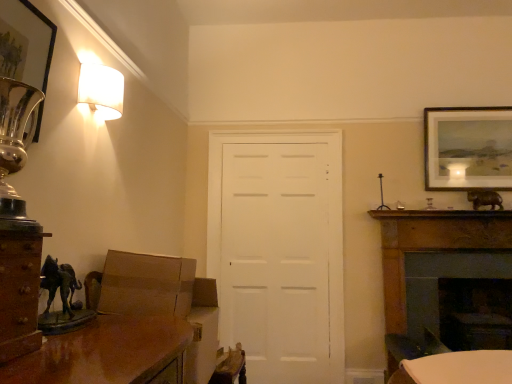
Find the location of a particular element. vacant space situated above dark wood fireplace at right, which is counted as the 1th fireplace, starting from the front (from a real-world perspective) is located at coordinates 455,222.